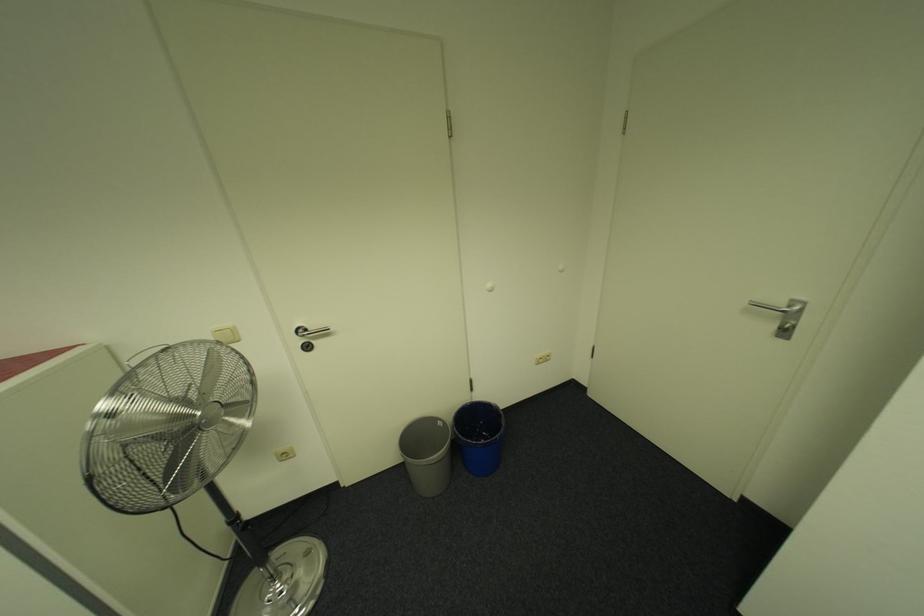
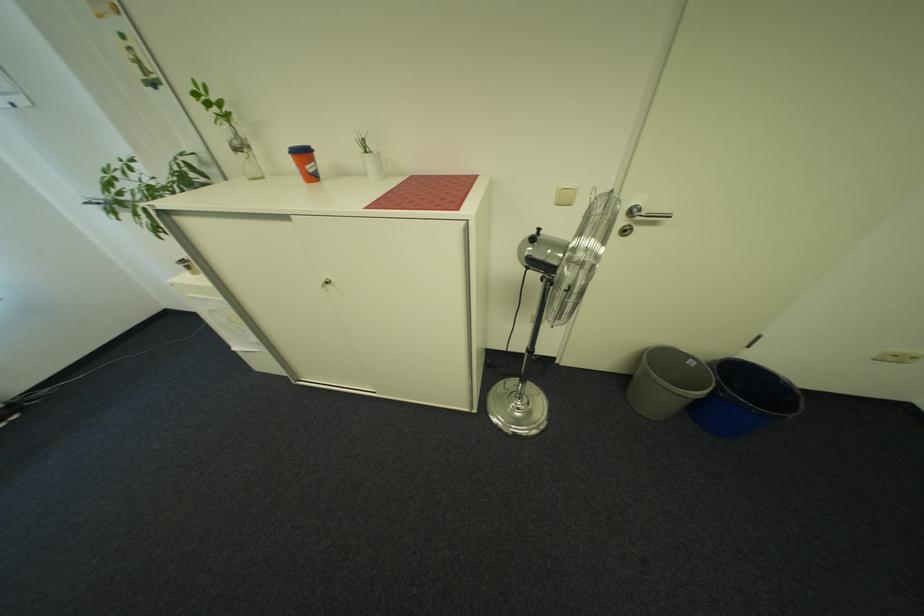
Locate, in the second image, the point that corresponds to [315,331] in the first image.

(650, 211)